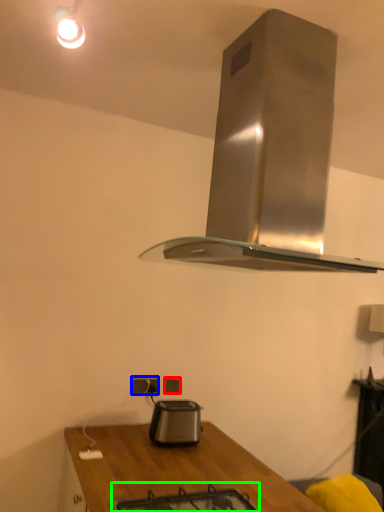
Question: Which object is the farthest from electric outlet (highlighted by a red box)? Choose among these: electric outlet (highlighted by a blue box) or gas stove (highlighted by a green box).

Choices:
 (A) electric outlet
 (B) gas stove

Answer: (B)